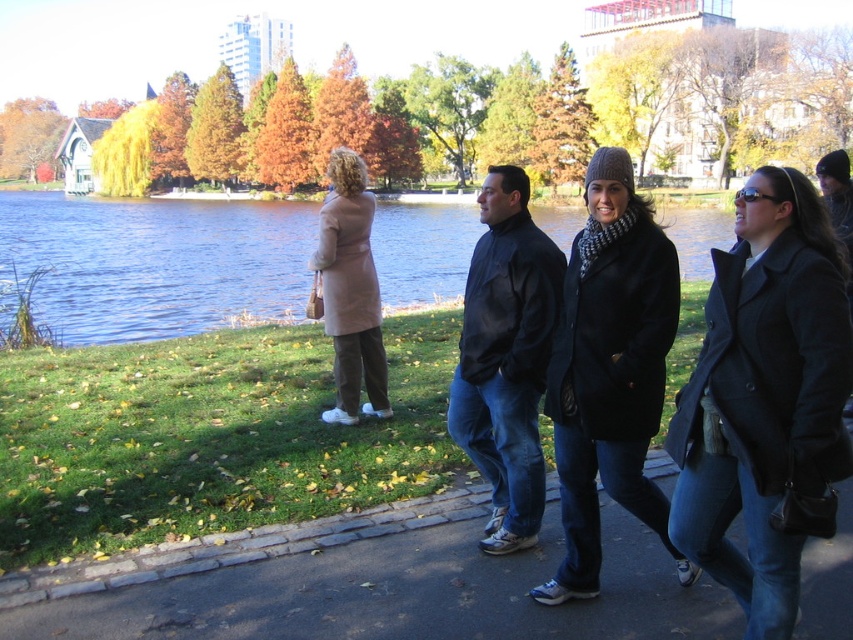
Between point (322, 552) and point (485, 371), which one is positioned behind?

The point (322, 552) is behind.

Looking at this image, does dark gray asphalt at lower center appear on the right side of dark blue jacket at center?

No, dark gray asphalt at lower center is not to the right of dark blue jacket at center.

Which is behind, point (851, 545) or point (523, 324)?

Point (851, 545)

Where is `dark gray asphalt at lower center`? This screenshot has width=853, height=640. dark gray asphalt at lower center is located at coordinates (366, 584).

Between point (767, 230) and point (274, 257), which one is positioned in front?

Point (767, 230) is in front.

Does dark gray wool coat at center have a greater height compared to blue water at center?

Incorrect, dark gray wool coat at center's height is not larger of blue water at center's.

Locate an element on the screen. dark gray wool coat at center is located at coordinates [764, 397].

Based on the photo, is dark gray wool coat at center to the left of beige wool coat at center from the viewer's perspective?

Incorrect, dark gray wool coat at center is not on the left side of beige wool coat at center.

Describe the element at coordinates (764, 397) in the screenshot. I see `dark gray wool coat at center` at that location.

Where is `dark gray wool coat at center`? Image resolution: width=853 pixels, height=640 pixels. dark gray wool coat at center is located at coordinates (764, 397).